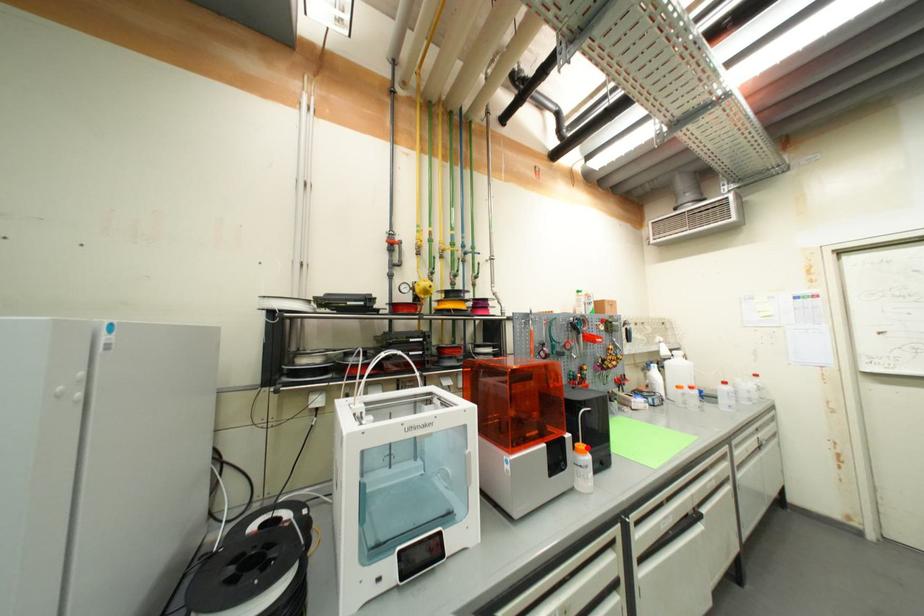
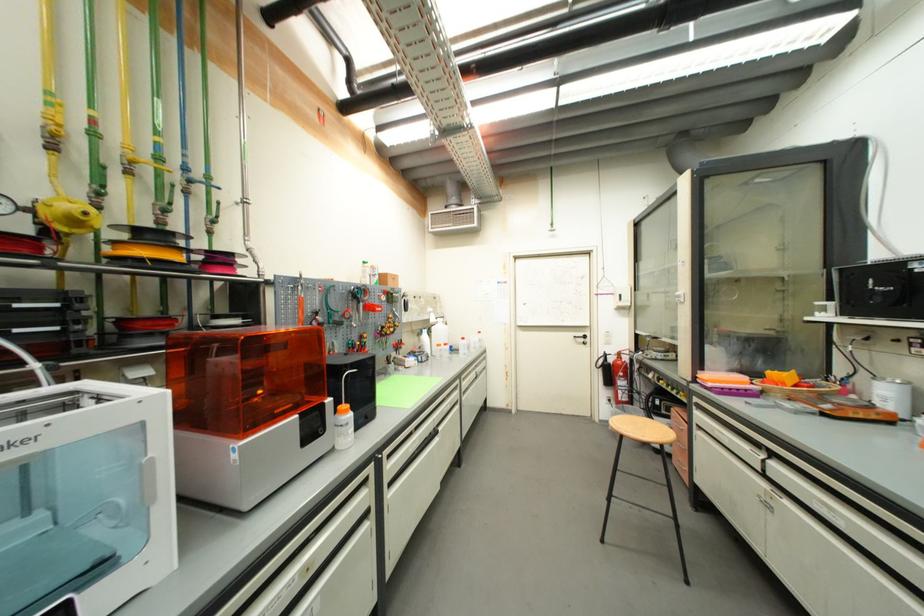
The point at the highlighted location is marked in the first image. Where is the corresponding point in the second image?

(349, 408)